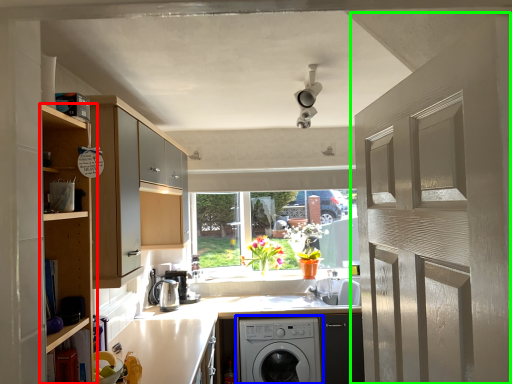
Question: Which object is positioned closest to cabinetry (highlighted by a red box)? Select from washing machine (highlighted by a blue box) and door (highlighted by a green box).

Choices:
 (A) washing machine
 (B) door

Answer: (B)